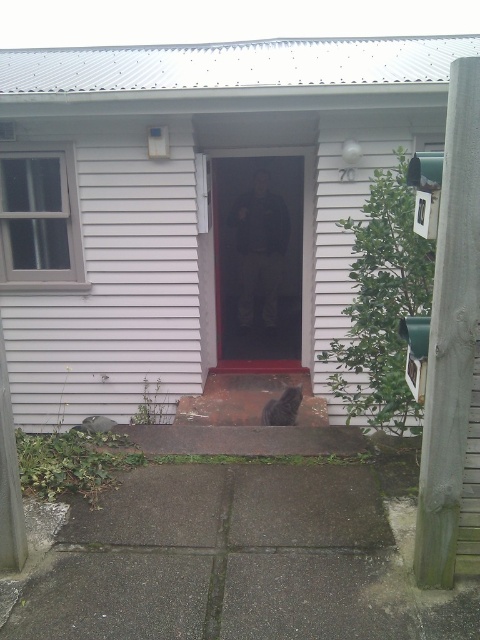
You are a delivery person trying to deliver a package to the house. You see the transparent plastic screen door at center and the black fur cat at center. Which object is closer to you, the delivery person?

The black fur cat at center is closer to you because the transparent plastic screen door at center is located above it, meaning the cat is in front of the door.

You are a delivery person trying to deliver a package to the house. The package is too large to fit through the transparent plastic screen door at center. Can you fit the package through the black fur cat at center instead?

The transparent plastic screen door at center is much taller as black fur cat at center, so the black fur cat at center is shorter. Therefore, the package cannot fit through the black fur cat at center.